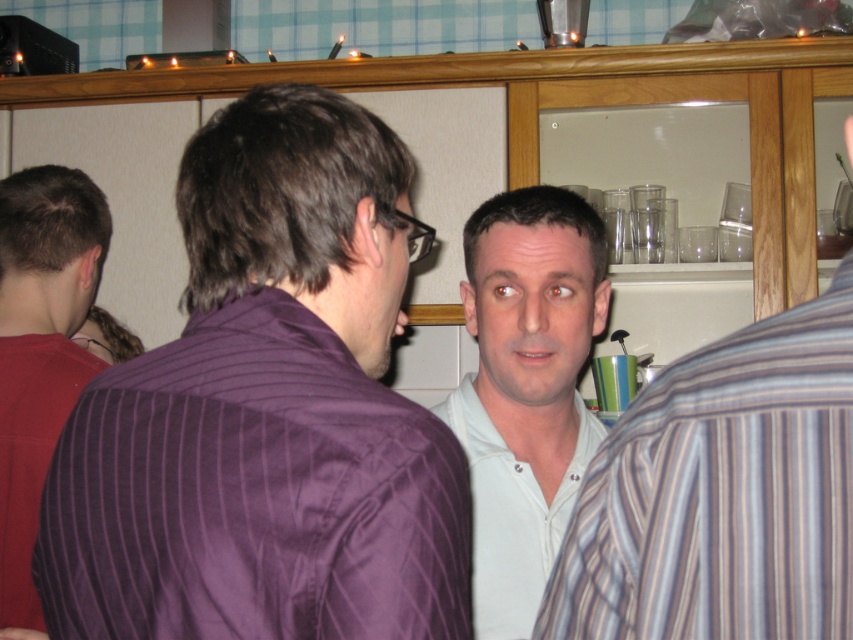
Question: Which object is the farthest from the white cotton shirt at center?

Choices:
 (A) white smooth shirt at center
 (B) purple striped shirt at center

Answer: (A)

Question: Does purple striped shirt at center have a lesser width compared to white cotton shirt at center?

Choices:
 (A) no
 (B) yes

Answer: (A)

Question: Does purple striped shirt at center have a larger size compared to white smooth shirt at center?

Choices:
 (A) no
 (B) yes

Answer: (B)

Question: Which object is the closest to the white cotton shirt at center?

Choices:
 (A) white smooth shirt at center
 (B) purple striped shirt at center
 (C) matte purple shirt at left

Answer: (B)

Question: Which of the following is the closest to the observer?

Choices:
 (A) (763, 513)
 (B) (18, 298)

Answer: (A)

Question: Can you confirm if purple striped shirt at center is smaller than white cotton shirt at center?

Choices:
 (A) yes
 (B) no

Answer: (B)